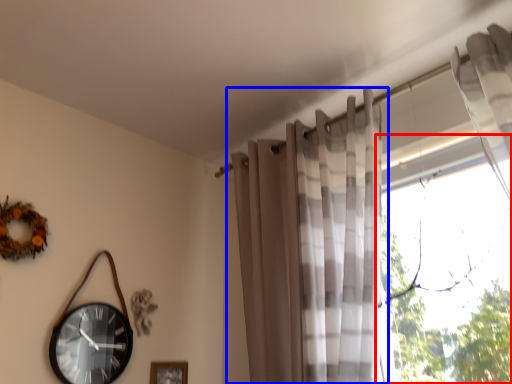
Question: Which of the following is the closest to the observer, window (highlighted by a red box) or curtain (highlighted by a blue box)?

Choices:
 (A) window
 (B) curtain

Answer: (A)